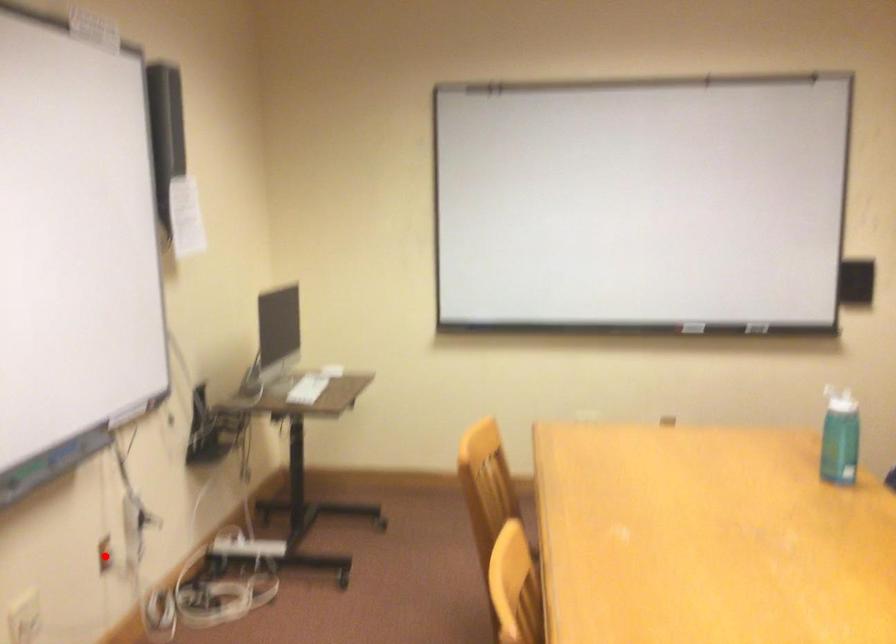
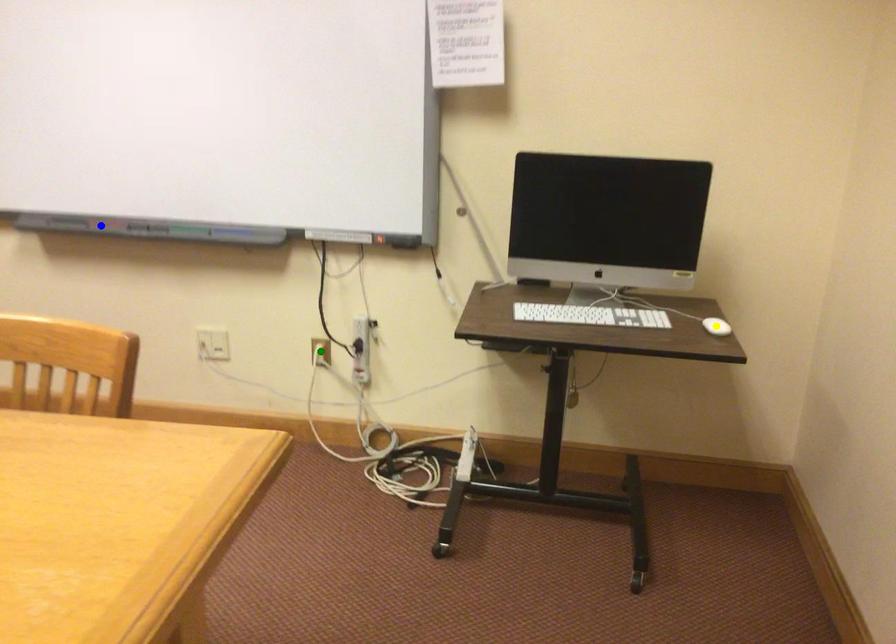
Question: I am providing you with two images of the same scene from different viewpoints. A red point is marked on the first image. You are given multiple points on the second image. Which point in image 2 is actually the same real-world point as the red point in image 1?

Choices:
 (A) blue point
 (B) yellow point
 (C) green point

Answer: (C)